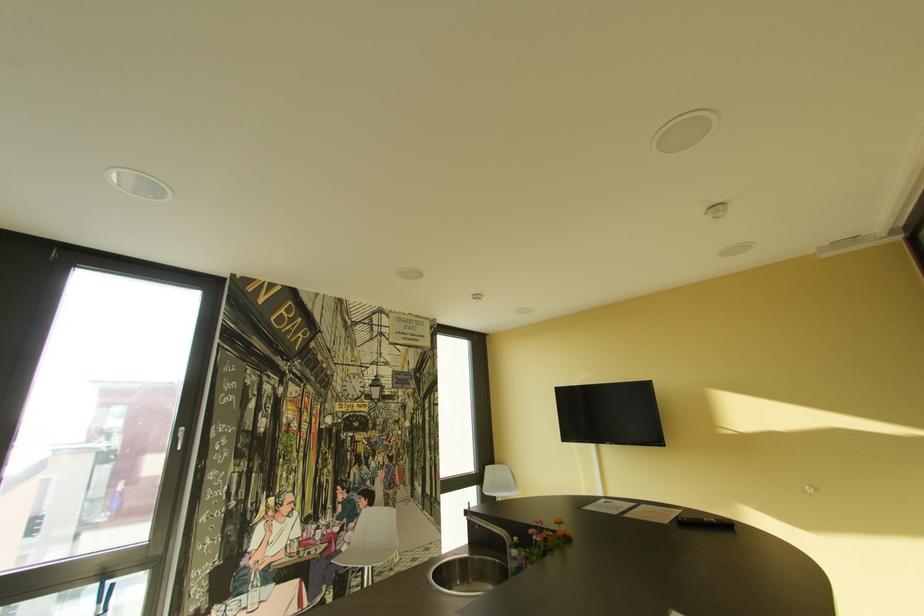
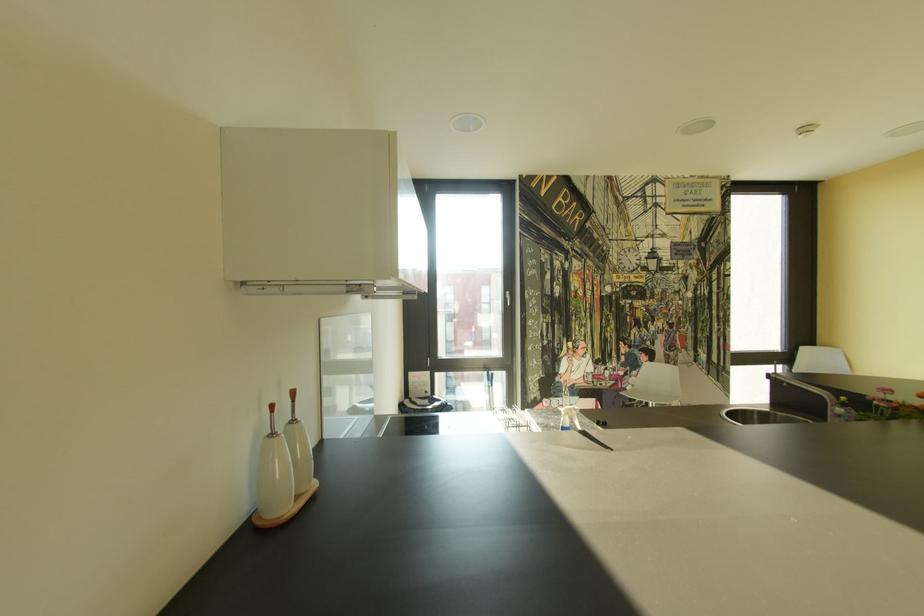
The images are taken continuously from a first-person perspective. In which direction is your viewpoint rotating?

The camera's rotation is toward left-down.